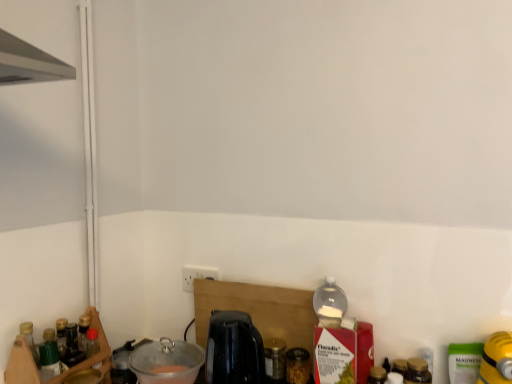
Question: From the image's perspective, is translucent glass jar at center, which ranks as the 2th bottle in right-to-left order, beneath clear plastic bowl at lower left, the second appliance positioned from the right?

Choices:
 (A) no
 (B) yes

Answer: (B)

Question: Is translucent glass jar at center, which is the 2th bottle from front to back, taller than clear plastic bowl at lower left, acting as the second appliance starting from the left?

Choices:
 (A) yes
 (B) no

Answer: (B)

Question: Considering the relative sizes of translucent glass jar at center, the second bottle viewed from the left, and clear plastic bowl at lower left, the second appliance positioned from the right, in the image provided, is translucent glass jar at center, the second bottle viewed from the left, thinner than clear plastic bowl at lower left, the second appliance positioned from the right,?

Choices:
 (A) no
 (B) yes

Answer: (B)

Question: Is translucent glass jar at center, the second bottle viewed from the left, positioned with its back to clear plastic bowl at lower left, acting as the second appliance starting from the left?

Choices:
 (A) no
 (B) yes

Answer: (A)

Question: From a real-world perspective, is translucent glass jar at center, which ranks as the 2th bottle in right-to-left order, physically above clear plastic bowl at lower left, acting as the second appliance starting from the left?

Choices:
 (A) no
 (B) yes

Answer: (A)

Question: From their relative heights in the image, would you say brown glass jar at lower right, the first bottle when ordered from right to left, is taller or shorter than transparent glass jar at center, acting as the first bottle starting from the left?

Choices:
 (A) tall
 (B) short

Answer: (A)

Question: Is brown glass jar at lower right, acting as the third bottle starting from the back, wider or thinner than transparent glass jar at center, marked as the first bottle in a back-to-front arrangement?

Choices:
 (A) thin
 (B) wide

Answer: (B)

Question: In the image, is brown glass jar at lower right, the 3th bottle in the left-to-right sequence, positioned in front of or behind transparent glass jar at center, arranged as the 3th bottle when viewed from the front?

Choices:
 (A) front
 (B) behind

Answer: (A)

Question: Considering the relative positions of brown glass jar at lower right, the 3th bottle in the left-to-right sequence, and transparent glass jar at center, arranged as the 3th bottle when viewed from the front, in the image provided, is brown glass jar at lower right, the 3th bottle in the left-to-right sequence, to the left or to the right of transparent glass jar at center, arranged as the 3th bottle when viewed from the front,?

Choices:
 (A) right
 (B) left

Answer: (A)

Question: From the image's perspective, relative to clear plastic bowl at lower left, the second appliance positioned from the right, is transparent glass jar at center, marked as the first bottle in a back-to-front arrangement, above or below?

Choices:
 (A) above
 (B) below

Answer: (B)

Question: From their relative heights in the image, would you say transparent glass jar at center, arranged as the 3th bottle when viewed from the front, is taller or shorter than clear plastic bowl at lower left, acting as the second appliance starting from the left?

Choices:
 (A) short
 (B) tall

Answer: (A)

Question: Would you say transparent glass jar at center, marked as the first bottle in a back-to-front arrangement, is to the left or to the right of clear plastic bowl at lower left, acting as the second appliance starting from the left, in the picture?

Choices:
 (A) right
 (B) left

Answer: (A)

Question: In the image, is transparent glass jar at center, marked as the first bottle in a back-to-front arrangement, positioned in front of or behind clear plastic bowl at lower left, the second appliance positioned from the right?

Choices:
 (A) behind
 (B) front

Answer: (A)

Question: Looking at the image, does transparent glass jar at center, acting as the first bottle starting from the left, seem bigger or smaller compared to black glossy coffee machine at center?

Choices:
 (A) small
 (B) big

Answer: (A)

Question: Does point (284, 372) appear closer or farther from the camera than point (257, 362)?

Choices:
 (A) farther
 (B) closer

Answer: (A)